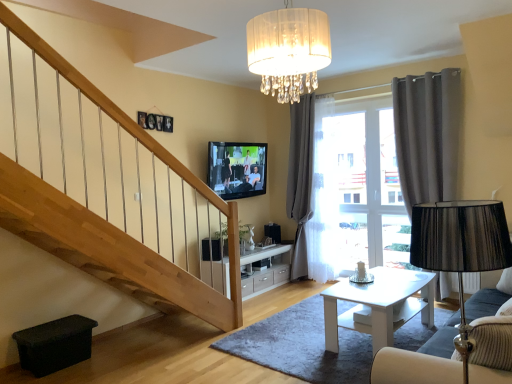
Question: Is translucent fabric chandelier at upper center taller or shorter than velvet blue sofa at lower right?

Choices:
 (A) short
 (B) tall

Answer: (A)

Question: Considering the positions of point (268, 87) and point (436, 367), is point (268, 87) closer or farther from the camera than point (436, 367)?

Choices:
 (A) farther
 (B) closer

Answer: (A)

Question: Which of these objects is positioned closest to the white glossy coffee table at center?

Choices:
 (A) white sheer curtain at center, which is the 2th curtain in front-to-back order
 (B) flat screen tv at upper center
 (C) dark gray fabric curtain at right, which ranks as the 2th curtain in back-to-front order
 (D) light wood/veneer cabinet at center
 (E) velvet blue sofa at lower right

Answer: (E)

Question: Which object is the farthest from the flat screen tv at upper center?

Choices:
 (A) white glossy coffee table at center
 (B) white sheer curtain at center, the 2th curtain positioned from the right
 (C) velvet blue sofa at lower right
 (D) translucent fabric chandelier at upper center
 (E) dark gray fabric curtain at right, which ranks as the 2th curtain in back-to-front order

Answer: (C)